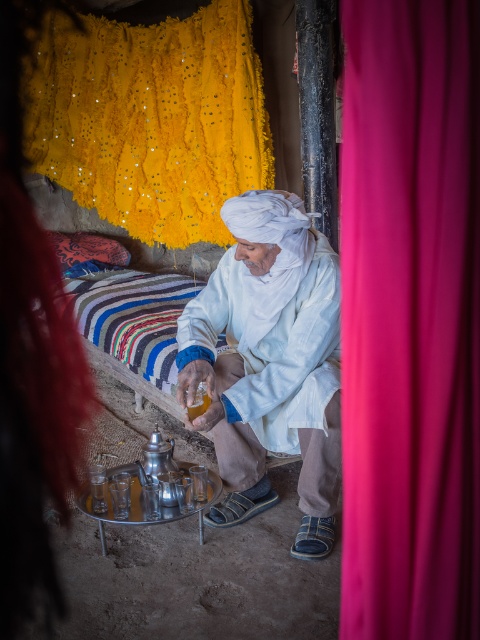
Question: Is velvet-like pink curtain at right positioned in front of shiny yellow fabric at upper left?

Choices:
 (A) yes
 (B) no

Answer: (A)

Question: Can you confirm if velvet-like pink curtain at right is smaller than white cotton turban at center?

Choices:
 (A) no
 (B) yes

Answer: (B)

Question: Which object is closer to the camera taking this photo?

Choices:
 (A) shiny yellow fabric at upper left
 (B) white cotton turban at center
 (C) velvet-like pink curtain at right

Answer: (C)

Question: Which point appears closest to the camera in this image?

Choices:
 (A) tap(445, 38)
 (B) tap(190, 140)

Answer: (A)

Question: Can you confirm if shiny yellow fabric at upper left is positioned to the right of white cotton turban at center?

Choices:
 (A) yes
 (B) no

Answer: (B)

Question: Which is farther from the velvet-like pink curtain at right?

Choices:
 (A) shiny yellow fabric at upper left
 (B) white cotton turban at center

Answer: (A)